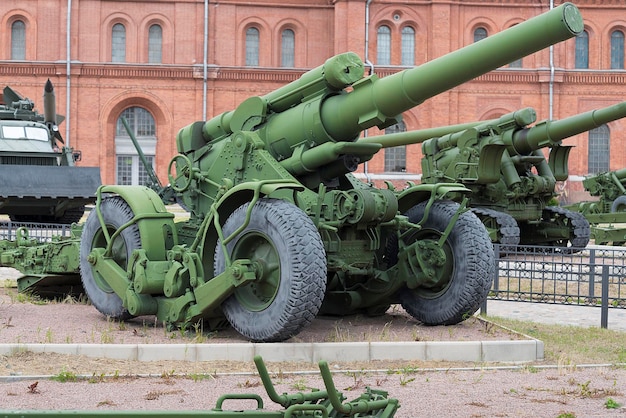
You are a GUI agent. You are given a task and a screenshot of the screen. Output one action in this format:
    pyautogui.click(x=<x>, y=<y>)
    Task: Click on the windows
    The height and width of the screenshot is (418, 626).
    Given the screenshot: What is the action you would take?
    pyautogui.click(x=131, y=131), pyautogui.click(x=274, y=27), pyautogui.click(x=382, y=38)